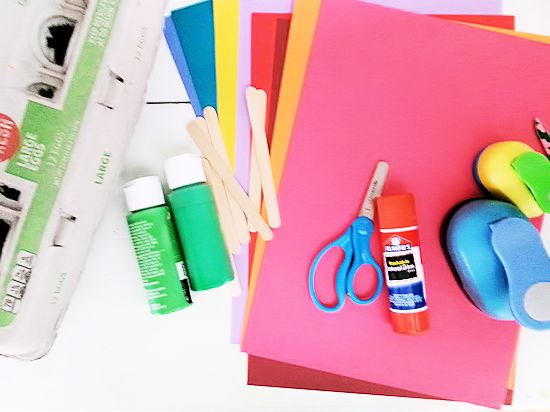
Locate an element on the screen. The image size is (550, 412). glue stick is located at coordinates [x=416, y=270].